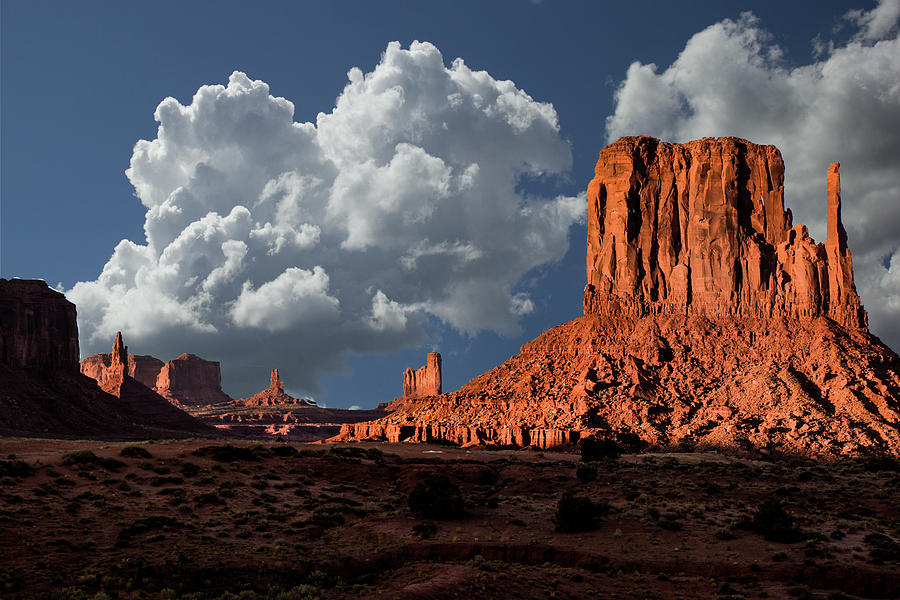
Identify the location of floor. (370, 548).